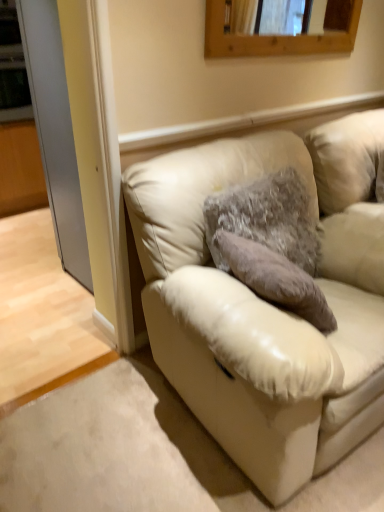
Question: In terms of size, does clear glass door at left appear bigger or smaller than beige leather couch at lower right?

Choices:
 (A) small
 (B) big

Answer: (A)

Question: From the image's perspective, relative to beige leather couch at lower right, is clear glass door at left above or below?

Choices:
 (A) below
 (B) above

Answer: (B)

Question: Which of these objects is positioned farthest from the clear glass door at left?

Choices:
 (A) beige leather couch at lower right
 (B) wooden frame at upper center
 (C) fuzzy fabric pillow at center

Answer: (A)

Question: Which object is the farthest from the clear glass door at left?

Choices:
 (A) fuzzy fabric pillow at center
 (B) beige leather couch at lower right
 (C) wooden frame at upper center

Answer: (B)